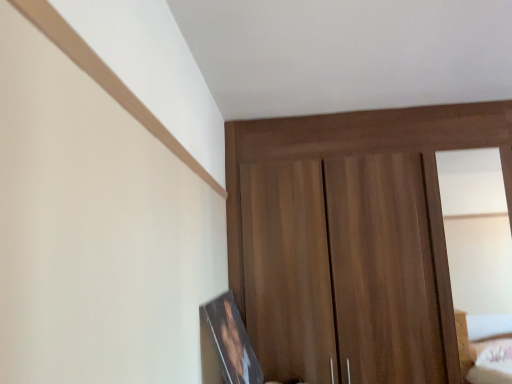
Where is `wooden wardrobe at center`? The height and width of the screenshot is (384, 512). wooden wardrobe at center is located at coordinates (350, 240).

The image size is (512, 384). Describe the element at coordinates (350, 240) in the screenshot. I see `wooden wardrobe at center` at that location.

Locate an element on the screen. Image resolution: width=512 pixels, height=384 pixels. wooden wardrobe at center is located at coordinates (350, 240).